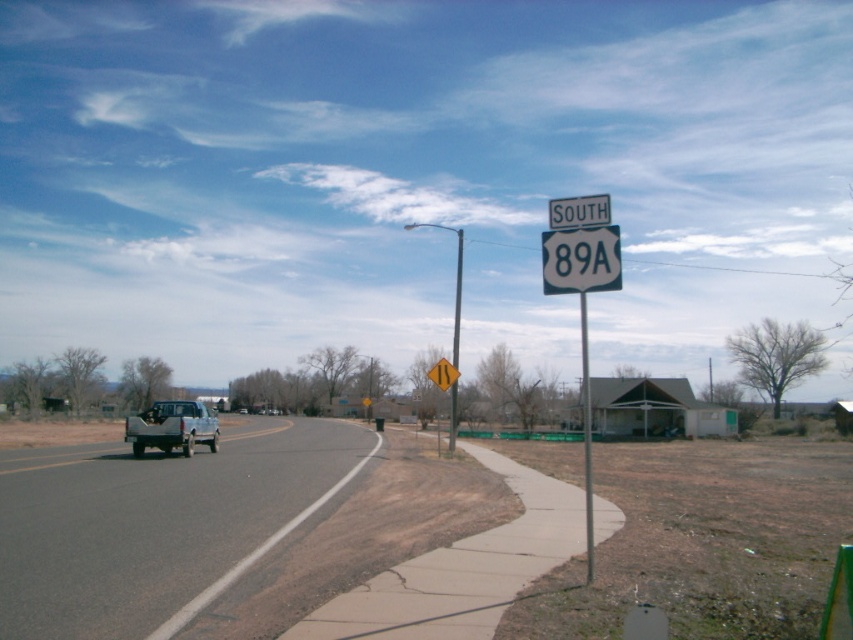
Describe the element at coordinates (155, 524) in the screenshot. This screenshot has height=640, width=853. I see `gray asphalt road at center` at that location.

The height and width of the screenshot is (640, 853). In order to click on gray asphalt road at center in this screenshot , I will do (x=155, y=524).

Find the location of a particular element. gray asphalt road at center is located at coordinates (155, 524).

Between metallic pole at right and yellow reflective plastic at center, which one is positioned lower?

yellow reflective plastic at center is lower down.

Who is more distant from viewer, (454, 304) or (444, 365)?

Positioned behind is point (454, 304).

This screenshot has height=640, width=853. What are the coordinates of `metallic pole at right` in the screenshot? It's located at (457, 298).

Is white plastic road sign at upper right below metallic pole at right?

Yes, white plastic road sign at upper right is below metallic pole at right.

Does white plastic road sign at upper right have a greater width compared to metallic pole at right?

Yes, white plastic road sign at upper right is wider than metallic pole at right.

Find the location of a particular element. The width and height of the screenshot is (853, 640). white plastic road sign at upper right is located at coordinates (581, 291).